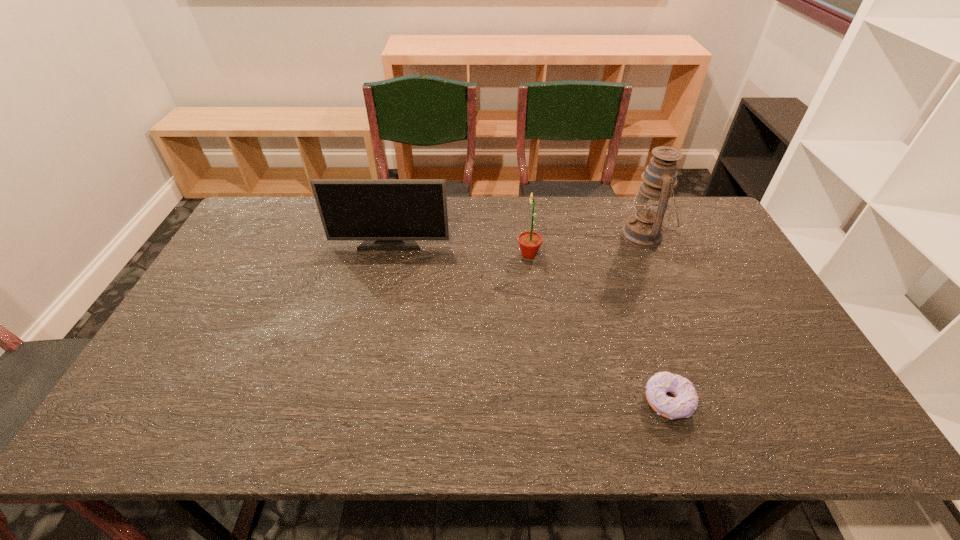
Identify which object is located as the nearest to the tallest object. Please provide its 2D coordinates. Your answer should be formatted as a tuple, i.e. [(x, y)], where the tuple contains the x and y coordinates of a point satisfying the conditions above.

[(530, 242)]

Identify which object is the second nearest to the second object from left to right. Please provide its 2D coordinates. Your answer should be formatted as a tuple, i.e. [(x, y)], where the tuple contains the x and y coordinates of a point satisfying the conditions above.

[(644, 229)]

At what (x,y) coordinates should I click in order to perform the action: click on vacant space that satisfies the following two spatial constraints: 1. on the front side of the tallest object; 2. on the face of the sunflower. Please return your answer as a coordinate pair (x, y). Looking at the image, I should click on (652, 255).

Locate an element on the screen. The width and height of the screenshot is (960, 540). vacant point that satisfies the following two spatial constraints: 1. on the face of the sunflower; 2. on the left side of the nearest object is located at coordinates (546, 401).

Where is `vacant area that satisfies the following two spatial constraints: 1. on the screen side of the nearest object; 2. on the right side of the leftmost object`? The height and width of the screenshot is (540, 960). vacant area that satisfies the following two spatial constraints: 1. on the screen side of the nearest object; 2. on the right side of the leftmost object is located at coordinates (354, 401).

Image resolution: width=960 pixels, height=540 pixels. In order to click on free space that satisfies the following two spatial constraints: 1. on the screen side of the monitor; 2. on the left side of the shortest object in this screenshot , I will do `click(354, 401)`.